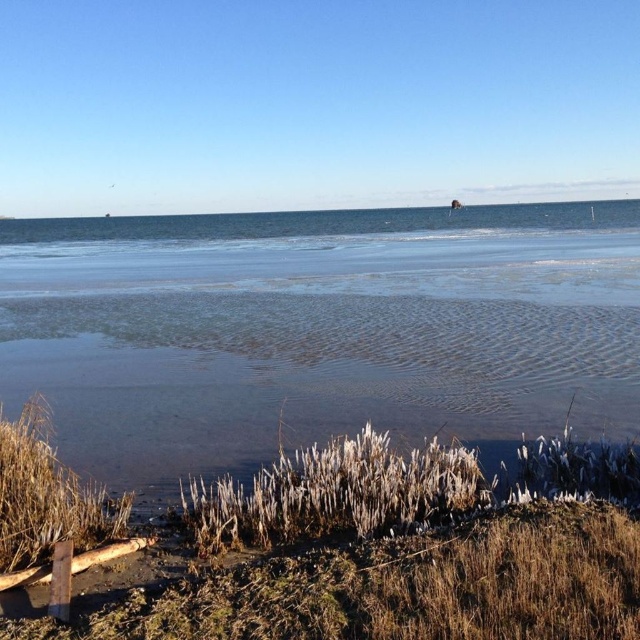
You are standing at the edge of the water in the coastal scene. You see clear water at lower center and brown grass at lower center. Which object is positioned to the left of the other?

The clear water at lower center is to the left of brown grass at lower center.

You are standing at the edge of the water in the coastal scene. You see two points marked in the image. Which point is closer to your position? The points are point 1 at coordinates point (106,420) and point 2 at coordinates point (221,502). Please answer based on their positions relative to your viewpoint.

Point 1 at coordinates point (106,420) is closer to your position because it is further to the camera than point 2 at coordinates point (221,502), meaning it is nearer to your viewpoint.